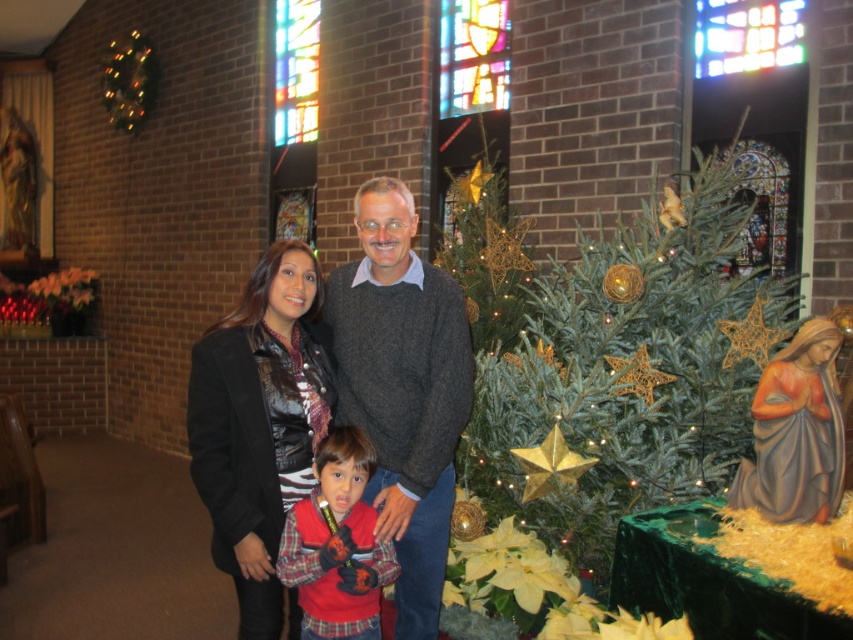
Question: Is black leather jacket at center to the right of red fleece jacket at center from the viewer's perspective?

Choices:
 (A) no
 (B) yes

Answer: (A)

Question: Does dark gray sweater at center have a greater width compared to matte gray statue at right?

Choices:
 (A) no
 (B) yes

Answer: (B)

Question: Where is matte gray statue at right located in relation to red fleece jacket at center in the image?

Choices:
 (A) right
 (B) left

Answer: (A)

Question: Based on their relative distances, which object is nearer to the matte gray statue at right?

Choices:
 (A) dark gray sweater at center
 (B) red fleece jacket at center
 (C) black leather jacket at center

Answer: (A)

Question: Which point appears farthest from the camera in this image?

Choices:
 (A) (546, 301)
 (B) (434, 628)
 (C) (788, 388)

Answer: (A)

Question: Estimate the real-world distances between objects in this image. Which object is farther from the matte gray statue at right?

Choices:
 (A) red fleece jacket at center
 (B) black leather jacket at center
 (C) dark gray sweater at center
 (D) green textured christmas tree at right

Answer: (B)